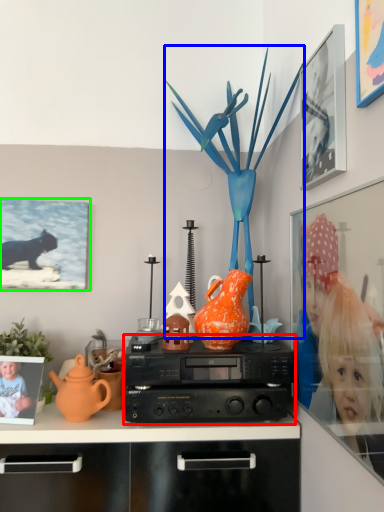
Question: Which object is the farthest from stereo (highlighted by a red box)? Choose among these: toy (highlighted by a blue box) or picture frame (highlighted by a green box).

Choices:
 (A) toy
 (B) picture frame

Answer: (B)